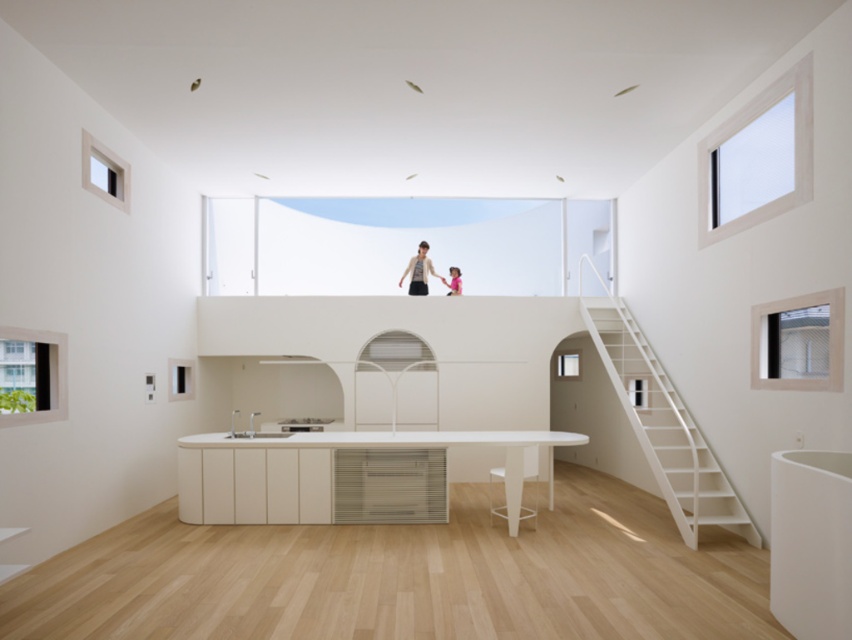
You are standing in the room and want to place a new plant stand at the point marked as point (x=620, y=339). If your arms can reach up to 1.8 meters, can you comfortably place the plant stand there without needing a ladder?

The distance of point (x=620, y=339) from camera is 9.62 meters, so you can comfortably place the plant stand there without needing a ladder since it is within your reach of 1.8 meters.

Consider the image. You are trying to decide whether to place a new rectangular table between the white wooden staircase at right and the white glossy stool at lower center. The table is 1.2 meters wide. Can the table fit between them based on their widths?

The white wooden staircase at right might be wider than the white glossy stool at lower center, but without specific width measurements, it is uncertain if the 1.2 meter table will fit between them. More information about their exact widths is needed to determine this.